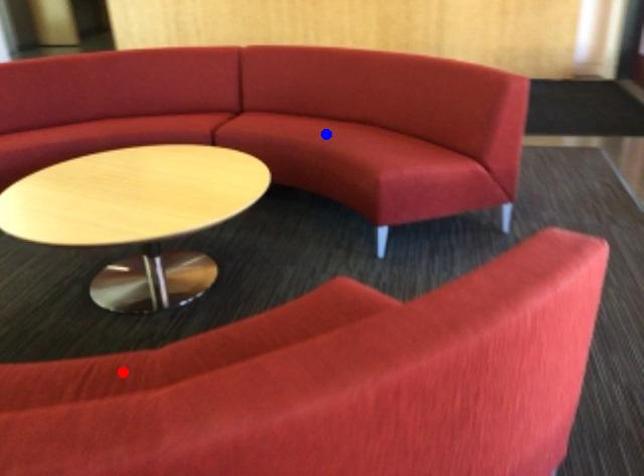
Question: Which of the two points in the image is closer to the camera?

Choices:
 (A) Blue point is closer.
 (B) Red point is closer.

Answer: (B)